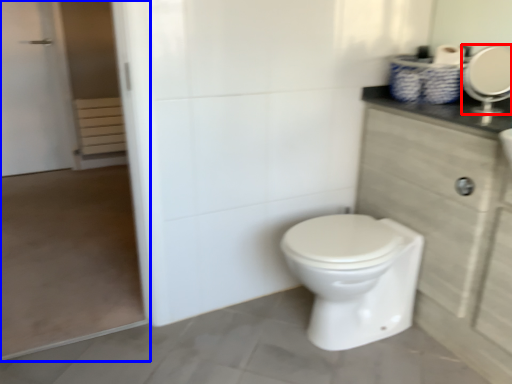
Question: Which object is closer to the camera taking this photo, mirror (highlighted by a red box) or screen door (highlighted by a blue box)?

Choices:
 (A) mirror
 (B) screen door

Answer: (B)